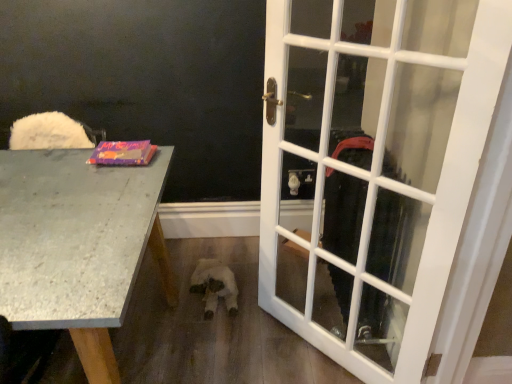
Question: Is white glass door at right in front of granite gray desk at left?

Choices:
 (A) no
 (B) yes

Answer: (A)

Question: Considering the relative positions of white glass door at right and granite gray desk at left in the image provided, is white glass door at right behind granite gray desk at left?

Choices:
 (A) yes
 (B) no

Answer: (A)

Question: From the image's perspective, is white glass door at right above granite gray desk at left?

Choices:
 (A) no
 (B) yes

Answer: (B)

Question: Does white glass door at right have a larger size compared to granite gray desk at left?

Choices:
 (A) no
 (B) yes

Answer: (A)

Question: From a real-world perspective, is white glass door at right physically above granite gray desk at left?

Choices:
 (A) yes
 (B) no

Answer: (A)

Question: From the image's perspective, is white glass door at right located beneath granite gray desk at left?

Choices:
 (A) no
 (B) yes

Answer: (A)

Question: Is white plush toy at center bigger than granite gray desk at left?

Choices:
 (A) no
 (B) yes

Answer: (A)

Question: Does white plush toy at center have a smaller size compared to granite gray desk at left?

Choices:
 (A) no
 (B) yes

Answer: (B)

Question: From a real-world perspective, is white plush toy at center below granite gray desk at left?

Choices:
 (A) no
 (B) yes

Answer: (B)

Question: Does white plush toy at center have a greater height compared to granite gray desk at left?

Choices:
 (A) yes
 (B) no

Answer: (B)

Question: Is white plush toy at center shorter than granite gray desk at left?

Choices:
 (A) yes
 (B) no

Answer: (A)

Question: Can you confirm if white plush toy at center is wider than granite gray desk at left?

Choices:
 (A) no
 (B) yes

Answer: (A)

Question: From the image's perspective, is granite gray desk at left located beneath matte purple book at left?

Choices:
 (A) yes
 (B) no

Answer: (A)